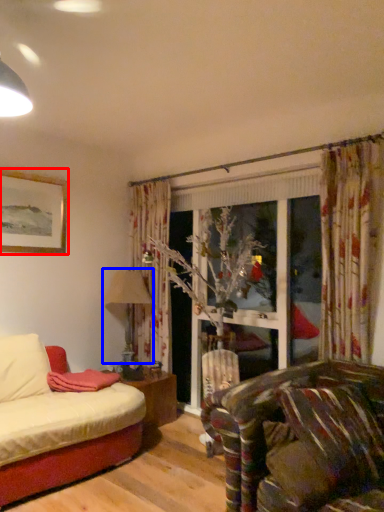
Question: Which object is further to the camera taking this photo, picture frame (highlighted by a red box) or lamp (highlighted by a blue box)?

Choices:
 (A) picture frame
 (B) lamp

Answer: (B)